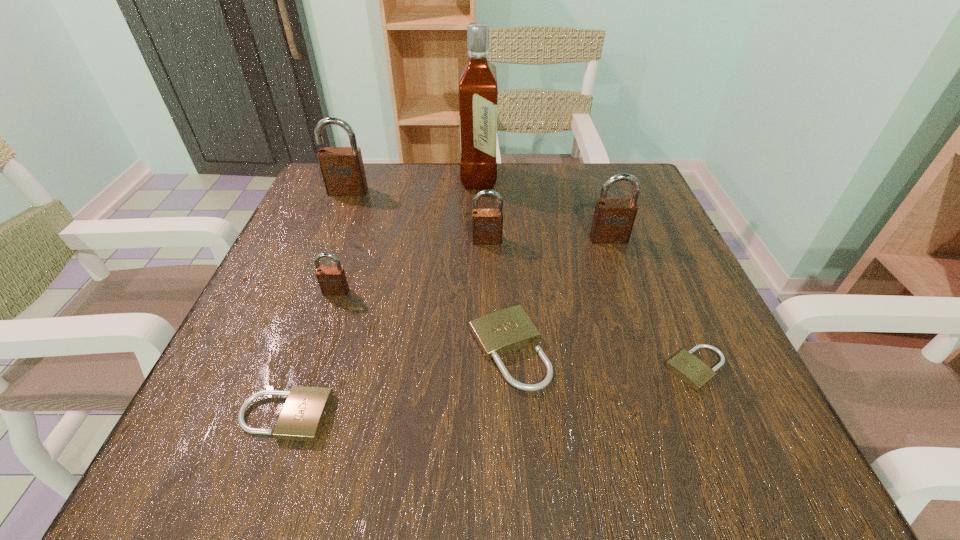
Find the location of a particular element. This screenshot has width=960, height=540. free spot between the third biggest brown padlock and the fifth tallest object is located at coordinates (412, 266).

Where is `vacant region between the tallest padlock and the tallest object`? vacant region between the tallest padlock and the tallest object is located at coordinates (413, 185).

Locate an element on the screen. The height and width of the screenshot is (540, 960). empty space between the tallest object and the farthest brown padlock is located at coordinates (413, 185).

You are a GUI agent. You are given a task and a screenshot of the screen. Output one action in this format:
    pyautogui.click(x=<x>, y=<y>)
    Task: Click on the free space between the second biggest beige padlock and the third tallest padlock
    The width and height of the screenshot is (960, 540).
    Given the screenshot: What is the action you would take?
    pyautogui.click(x=386, y=328)

Find the location of a particular element. This screenshot has width=960, height=540. the second closest object to the second smallest brown padlock is located at coordinates (613, 220).

Where is `object that stands as the fifth closest to the third shortest padlock`? This screenshot has width=960, height=540. object that stands as the fifth closest to the third shortest padlock is located at coordinates (332, 280).

Image resolution: width=960 pixels, height=540 pixels. What are the coordinates of `padlock that is the fifth nearest to the second shortest object` in the screenshot? It's located at (342, 168).

Select which padlock is the sixth closest to the nearest brown padlock. Please provide its 2D coordinates. Your answer should be formatted as a tuple, i.e. [(x, y)], where the tuple contains the x and y coordinates of a point satisfying the conditions above.

[(686, 366)]

Choose which brown padlock is the third nearest neighbor to the third shortest object. Please provide its 2D coordinates. Your answer should be formatted as a tuple, i.e. [(x, y)], where the tuple contains the x and y coordinates of a point satisfying the conditions above.

[(332, 280)]

Identify which brown padlock is the second nearest to the third shortest padlock. Please provide its 2D coordinates. Your answer should be formatted as a tuple, i.e. [(x, y)], where the tuple contains the x and y coordinates of a point satisfying the conditions above.

[(613, 220)]